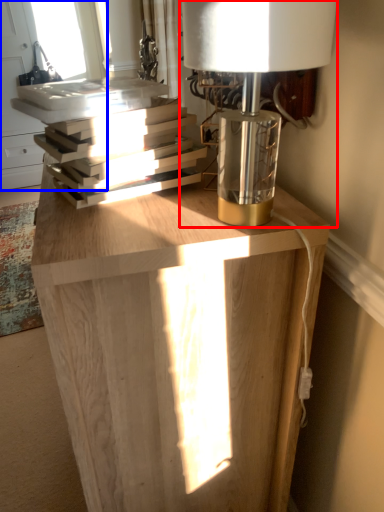
Question: Which object appears closest to the camera in this image, lamp (highlighted by a red box) or window (highlighted by a blue box)?

Choices:
 (A) lamp
 (B) window

Answer: (A)